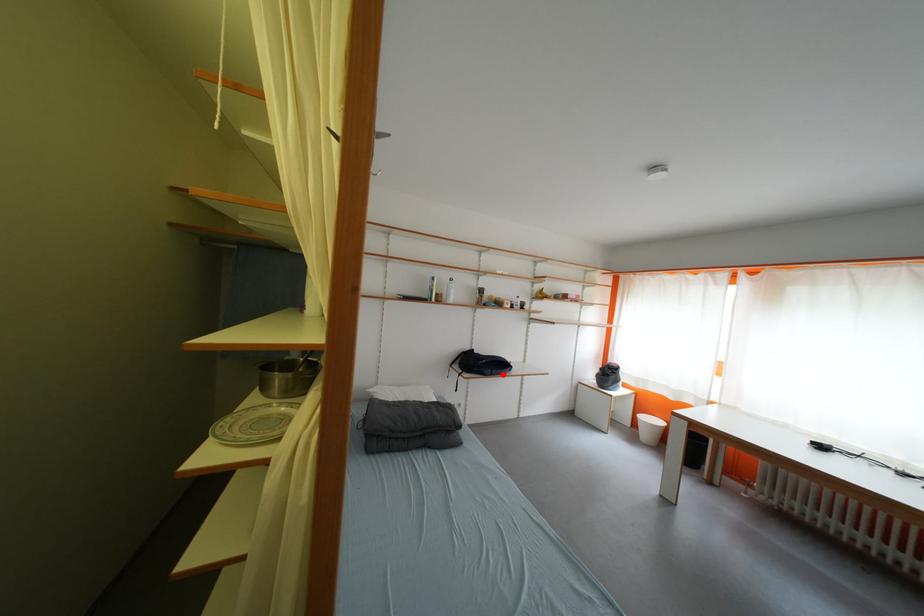
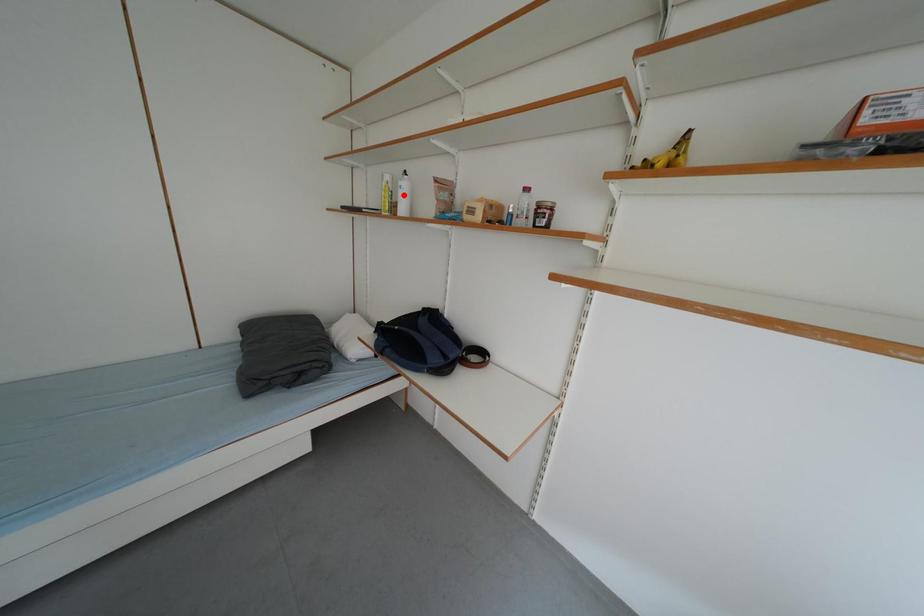
I am providing you with two images of the same scene from different viewpoints. A red point is marked on the first image and another point is marked on the second image. Is the marked point in image1 the same physical position as the marked point in image2?

No